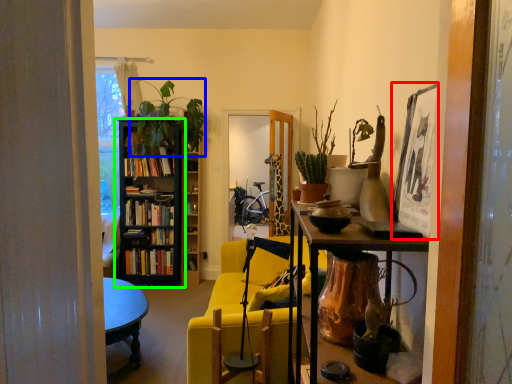
Question: Which object is the farthest from picture frame (highlighted by a red box)? Choose among these: plant (highlighted by a blue box) or bookcase (highlighted by a green box).

Choices:
 (A) plant
 (B) bookcase

Answer: (B)